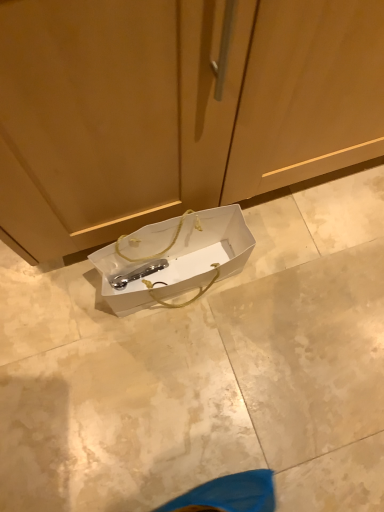
Question: Would you say matte wood cabinet at center is part of white paper bag at center's contents?

Choices:
 (A) yes
 (B) no

Answer: (B)

Question: Does white paper bag at center have a larger size compared to matte wood cabinet at center?

Choices:
 (A) no
 (B) yes

Answer: (A)

Question: Does white paper bag at center have a lesser width compared to matte wood cabinet at center?

Choices:
 (A) no
 (B) yes

Answer: (B)

Question: Is white paper bag at center further to camera compared to matte wood cabinet at center?

Choices:
 (A) no
 (B) yes

Answer: (B)

Question: Are white paper bag at center and matte wood cabinet at center located far from each other?

Choices:
 (A) no
 (B) yes

Answer: (A)

Question: Can you confirm if white paper bag at center is wider than matte wood cabinet at center?

Choices:
 (A) no
 (B) yes

Answer: (A)

Question: From a real-world perspective, is matte wood cabinet at center positioned over white paper bag at center based on gravity?

Choices:
 (A) no
 (B) yes

Answer: (B)

Question: Are matte wood cabinet at center and white paper bag at center beside each other?

Choices:
 (A) yes
 (B) no

Answer: (B)

Question: Would you say matte wood cabinet at center is outside white paper bag at center?

Choices:
 (A) yes
 (B) no

Answer: (A)

Question: Considering the relative sizes of matte wood cabinet at center and white paper bag at center in the image provided, is matte wood cabinet at center shorter than white paper bag at center?

Choices:
 (A) yes
 (B) no

Answer: (B)

Question: Does matte wood cabinet at center have a smaller size compared to white paper bag at center?

Choices:
 (A) yes
 (B) no

Answer: (B)

Question: Considering the relative positions of matte wood cabinet at center and white paper bag at center in the image provided, is matte wood cabinet at center to the right of white paper bag at center from the viewer's perspective?

Choices:
 (A) yes
 (B) no

Answer: (A)

Question: In terms of size, does matte wood cabinet at center appear bigger or smaller than white paper bag at center?

Choices:
 (A) small
 (B) big

Answer: (B)